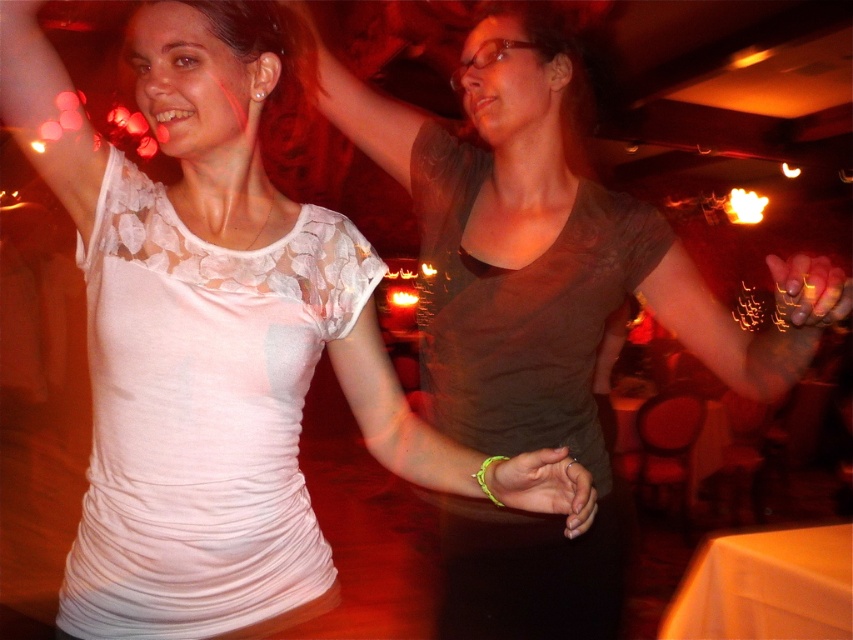
You are a photographer trying to capture a closeup of the neon green wristband at center while ensuring the matte brown shirt at center is still visible in the frame. Given their sizes, will you need to adjust your camera to a wider angle to include both?

The matte brown shirt at center is bigger than the neon green wristband at center, so you will need to adjust your camera to a wider angle to include both in the frame since the shirt takes up more space.

You are a photographer trying to capture the neon green wristband at center and the shiny gold nail polish at upper right in the same frame. Which object should you focus on first if you want to ensure both are in focus, considering their sizes?

The neon green wristband at center should be focused on first because it occupies less space than the shiny gold nail polish at upper right, making it smaller and requiring precise focus to capture details.